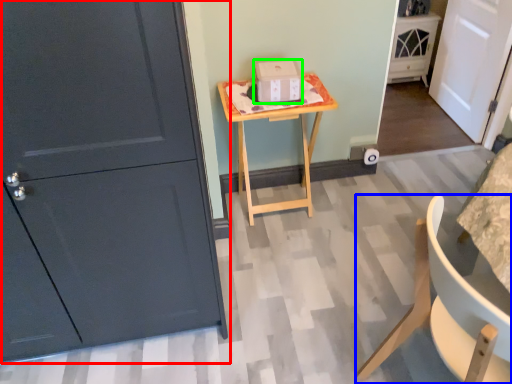
Question: Which object is the closest to the door (highlighted by a red box)? Choose among these: chair (highlighted by a blue box) or cardboard box (highlighted by a green box).

Choices:
 (A) chair
 (B) cardboard box

Answer: (A)